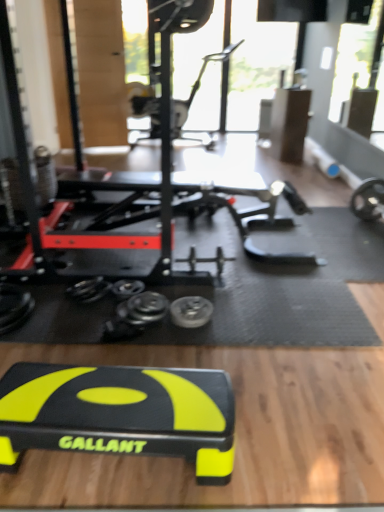
Find the location of a particular element. vacant space behind black rubber step platform at center, which is the second sport equipment in back-to-front order is located at coordinates (143, 348).